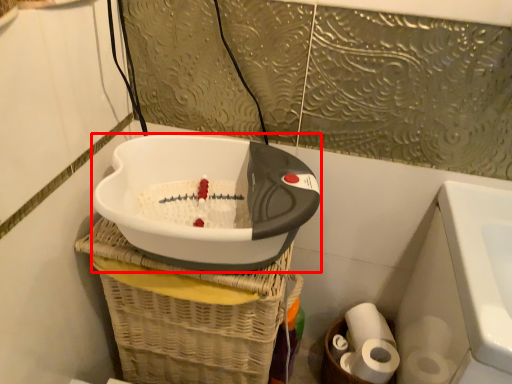
Question: Considering the relative positions of appliance (annotated by the red box) and toilet paper in the image provided, where is appliance (annotated by the red box) located with respect to the staircase?

Choices:
 (A) left
 (B) right

Answer: (A)